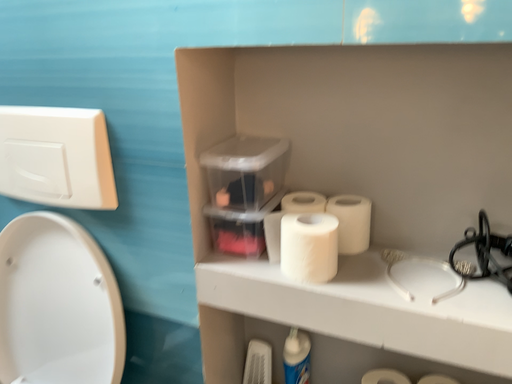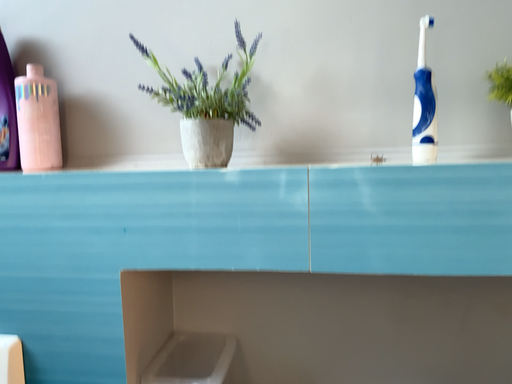
Question: How did the camera likely rotate when shooting the video?

Choices:
 (A) rotated upward
 (B) rotated downward

Answer: (A)